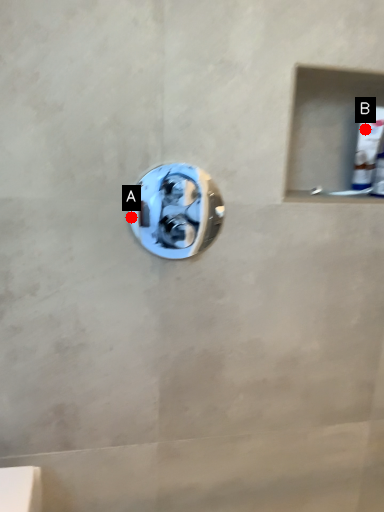
Question: Two points are circled on the image, labeled by A and B beside each circle. Which of the following is the closest to the observer?

Choices:
 (A) A is closer
 (B) B is closer

Answer: (A)